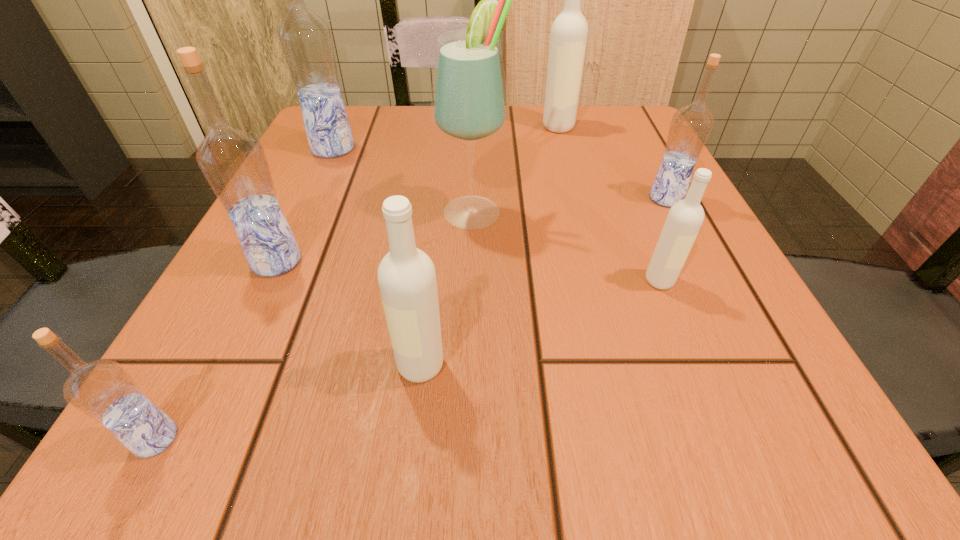
Locate an element on the screen. vacant space located on the back of the rightmost white vodka is located at coordinates (618, 177).

Identify the location of free point located 0.260m on the back of the nearest object. The width and height of the screenshot is (960, 540). (252, 258).

This screenshot has height=540, width=960. Identify the location of object that is at the near edge. (103, 390).

Locate an element on the screen. This screenshot has width=960, height=540. object located in the far left corner section of the desktop is located at coordinates (306, 42).

Where is `object present at the near left corner`? This screenshot has height=540, width=960. object present at the near left corner is located at coordinates (103, 390).

Find the location of a particular element. object that is at the far right corner is located at coordinates (569, 32).

Find the location of a particular element. This screenshot has width=960, height=540. free space at the far edge of the desktop is located at coordinates (509, 124).

This screenshot has width=960, height=540. Find the location of `free space at the near edge of the desktop`. free space at the near edge of the desktop is located at coordinates (635, 398).

Where is `free location at the left edge of the desktop`? The height and width of the screenshot is (540, 960). free location at the left edge of the desktop is located at coordinates (338, 162).

The width and height of the screenshot is (960, 540). I want to click on vacant area at the right edge, so click(x=664, y=324).